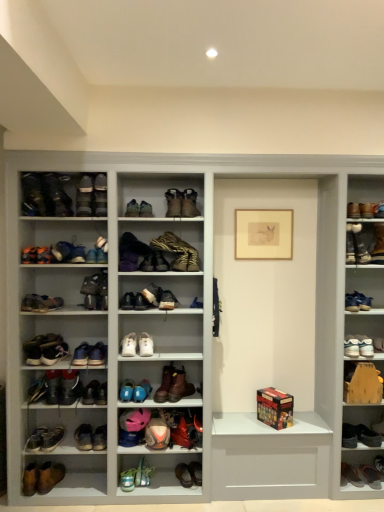
Where is `blank area to the left of brown leather shoe at lower center, which is the 13th footwear in right-to-left order`? blank area to the left of brown leather shoe at lower center, which is the 13th footwear in right-to-left order is located at coordinates (169, 487).